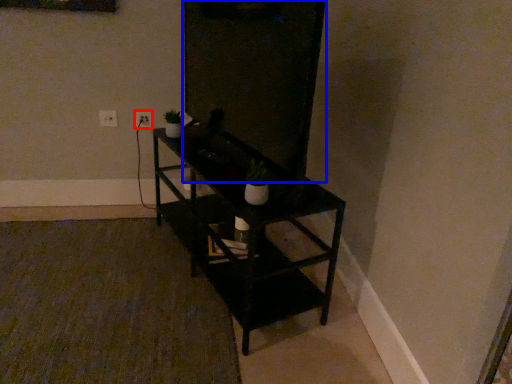
Question: Which of the following is the farthest to the observer, electric outlet (highlighted by a red box) or glass door (highlighted by a blue box)?

Choices:
 (A) electric outlet
 (B) glass door

Answer: (A)